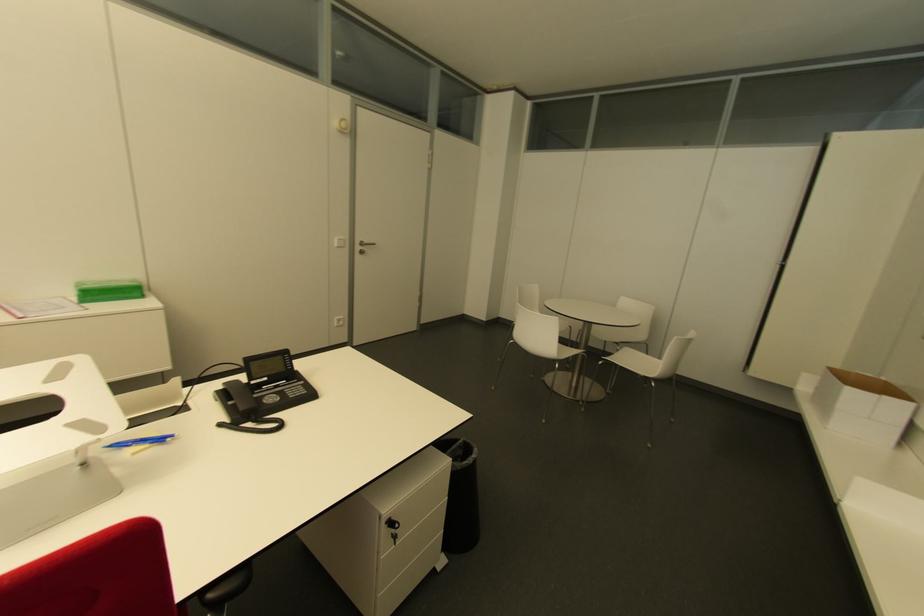
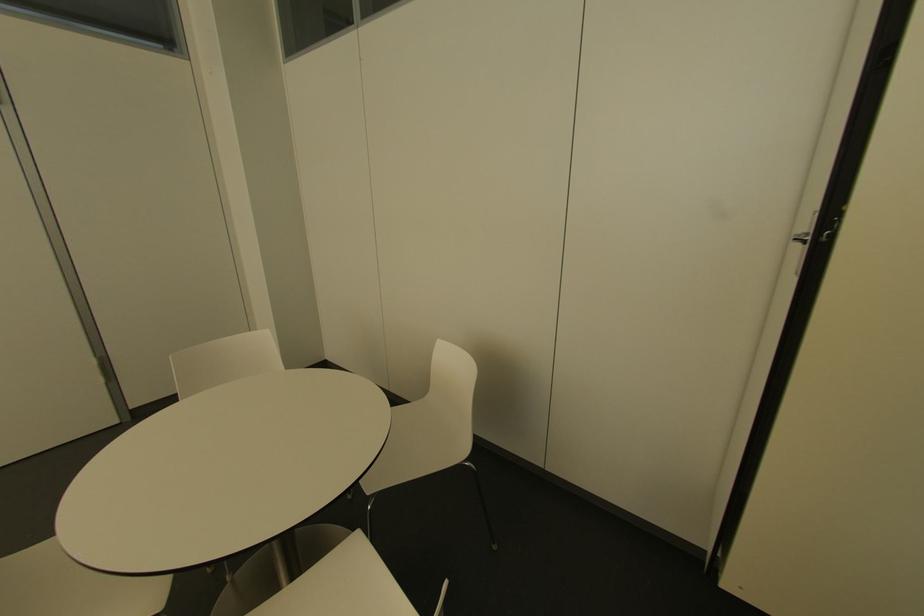
Which direction would the cameraman need to move to produce the second image?

The movement direction of the cameraman is right, forward.